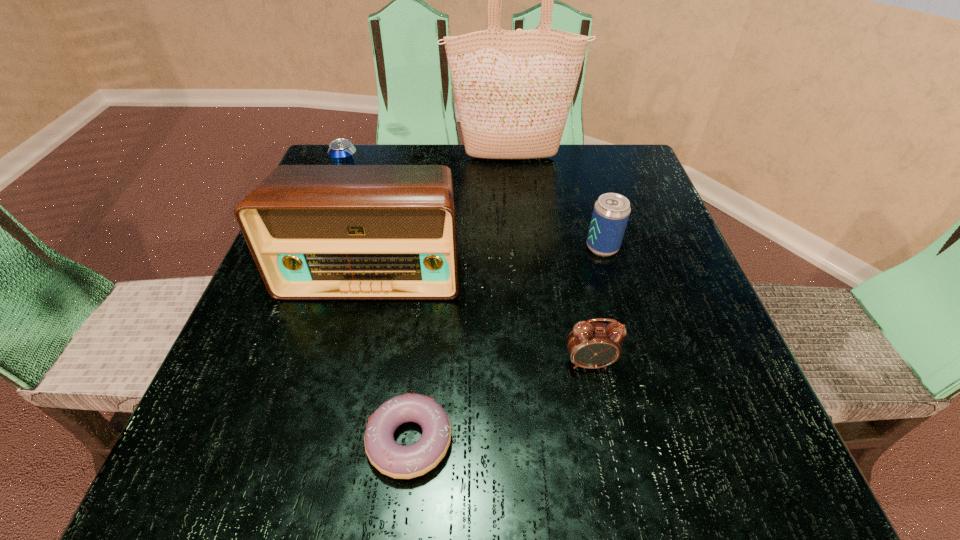
This screenshot has width=960, height=540. What are the coordinates of `shopping bag located at the right edge` in the screenshot? It's located at (513, 88).

Locate an element on the screen. This screenshot has height=540, width=960. beer can located in the right edge section of the desktop is located at coordinates (611, 212).

This screenshot has width=960, height=540. Find the location of `object situated at the far left corner`. object situated at the far left corner is located at coordinates (341, 151).

In order to click on object located at the far right corner in this screenshot , I will do `click(513, 88)`.

Where is `vacant point at the far edge`? This screenshot has height=540, width=960. vacant point at the far edge is located at coordinates (527, 198).

You are a GUI agent. You are given a task and a screenshot of the screen. Output one action in this format:
    pyautogui.click(x=<x>, y=<y>)
    Task: Click on the free space at the near edge
    The height and width of the screenshot is (540, 960).
    Given the screenshot: What is the action you would take?
    pyautogui.click(x=537, y=433)

Image resolution: width=960 pixels, height=540 pixels. In the image, there is a desktop. What are the coordinates of `free space at the left edge` in the screenshot? It's located at (198, 419).

The height and width of the screenshot is (540, 960). Identify the location of free space at the right edge of the desktop. (661, 205).

What are the coordinates of `blank space at the far right corner` in the screenshot? It's located at (641, 176).

Identify the location of free region at the near right corner of the desktop. The height and width of the screenshot is (540, 960). (734, 466).